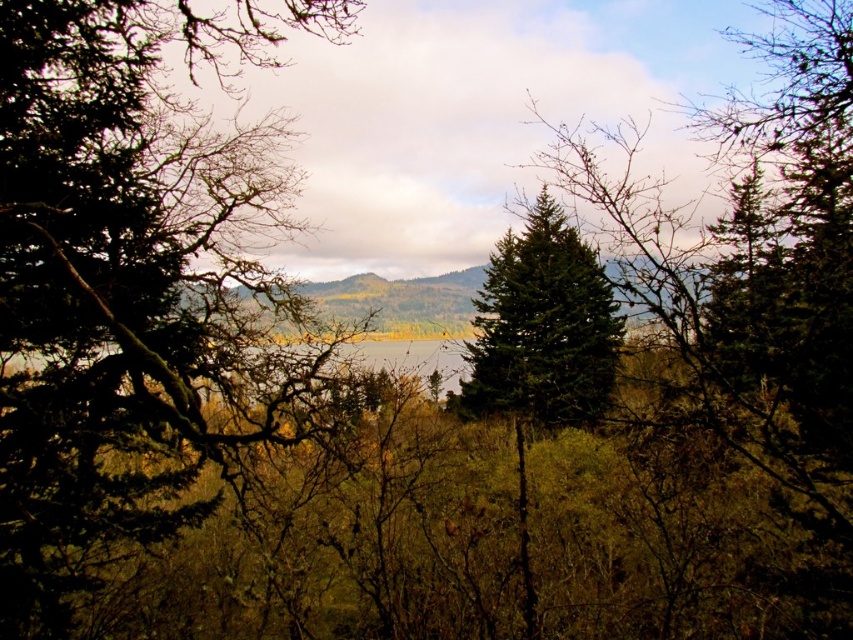
Looking at this image, you are an artist sketching this scene. You notice the green matte pine at center and the green matte forest at center. Which one should you draw first if you want to follow the standard layering technique of starting with the background first?

The green matte forest at center should be drawn first because it is located above the green matte pine at center, making it part of the background layer.

You are an artist setting up an easel to paint the landscape. You want to capture both the green matte tree at left and the green matte pine at center in your painting. Which tree should you position closer to the foreground of your painting to accurately represent their sizes?

The green matte pine at center is taller than the green matte tree at left, so to accurately represent their sizes, you should position the green matte tree at left closer to the foreground of your painting.